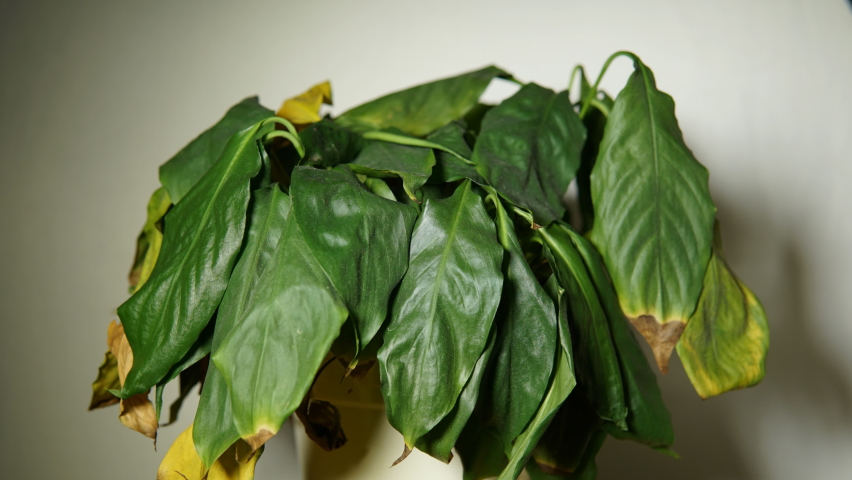
You are a GUI agent. You are given a task and a screenshot of the screen. Output one action in this format:
    pyautogui.click(x=<x>, y=<y>)
    Task: Click on the light yellow pot
    The height and width of the screenshot is (480, 852).
    Given the screenshot: What is the action you would take?
    pyautogui.click(x=417, y=466)